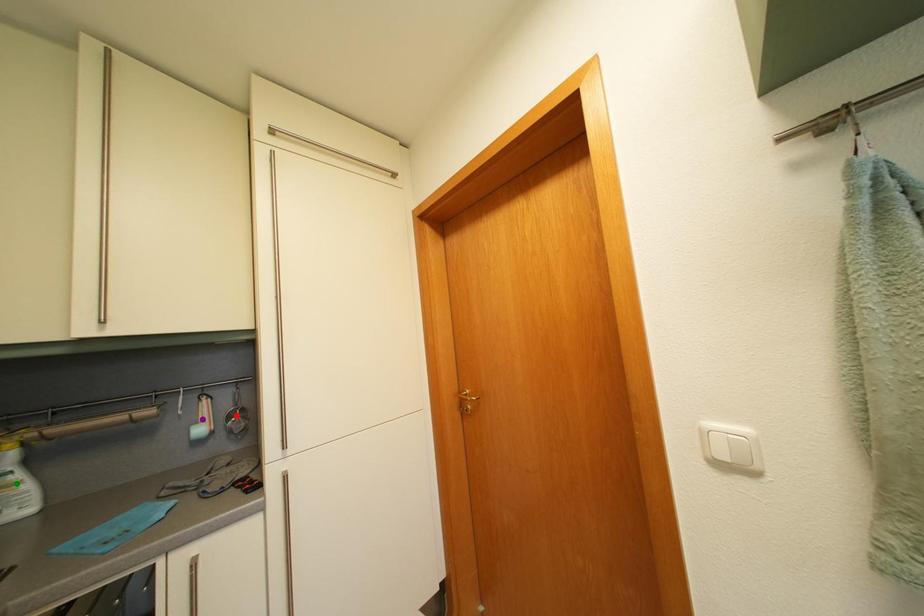
Order these from farthest to nearest:
1. green point
2. red point
3. purple point

1. red point
2. purple point
3. green point